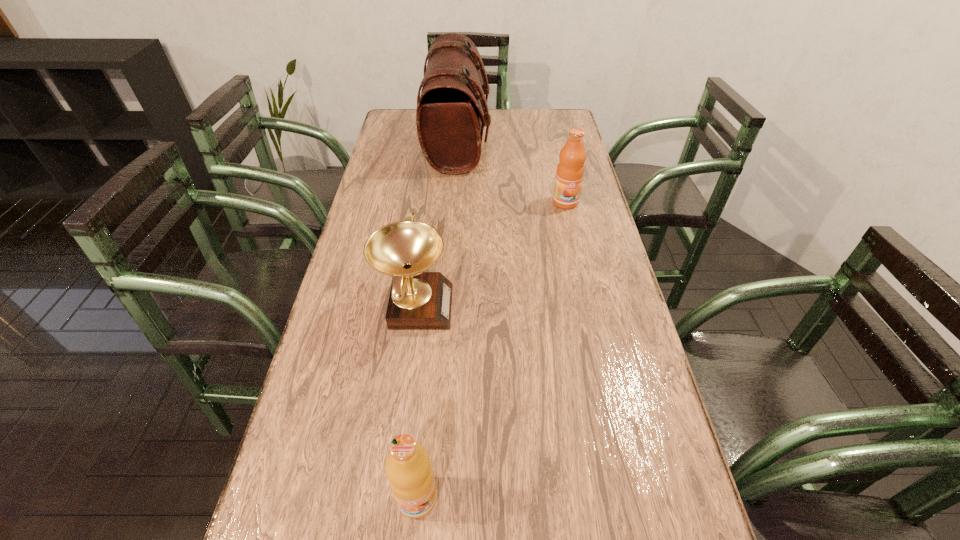
Locate an element on the screen. This screenshot has width=960, height=540. vacant space that satisfies the following two spatial constraints: 1. on the label side of the rightmost object; 2. on the front-facing side of the second nearest object is located at coordinates (588, 305).

This screenshot has height=540, width=960. I want to click on free point that satisfies the following two spatial constraints: 1. on the label side of the farther fruit juice; 2. on the front-facing side of the award, so [x=588, y=305].

Locate an element on the screen. Image resolution: width=960 pixels, height=540 pixels. free region that satisfies the following two spatial constraints: 1. on the front-facing side of the satchel; 2. on the front label of the nearest object is located at coordinates (433, 498).